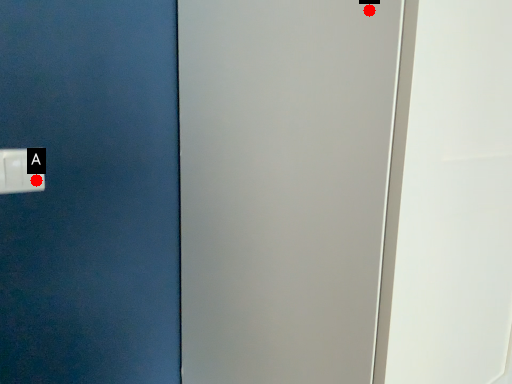
Question: Two points are circled on the image, labeled by A and B beside each circle. Which point is closer to the camera?

Choices:
 (A) A is closer
 (B) B is closer

Answer: (B)